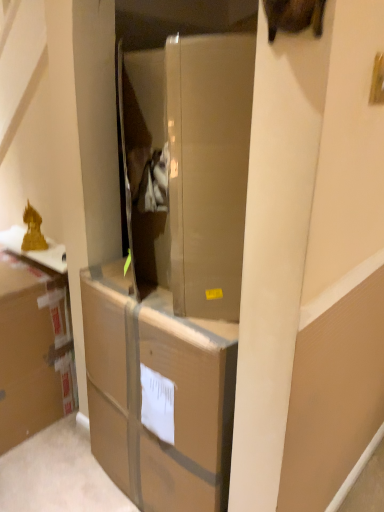
Question: Does brown cardboard box at center have a lesser width compared to brown cardboard box at left?

Choices:
 (A) no
 (B) yes

Answer: (A)

Question: Is brown cardboard box at center bigger than brown cardboard box at left?

Choices:
 (A) no
 (B) yes

Answer: (B)

Question: Is brown cardboard box at center positioned with its back to brown cardboard box at left?

Choices:
 (A) no
 (B) yes

Answer: (A)

Question: Is there a large distance between brown cardboard box at center and brown cardboard box at left?

Choices:
 (A) no
 (B) yes

Answer: (A)

Question: Is brown cardboard box at center taller than brown cardboard box at left?

Choices:
 (A) no
 (B) yes

Answer: (B)

Question: Does brown cardboard box at center have a lesser height compared to brown cardboard box at left?

Choices:
 (A) no
 (B) yes

Answer: (A)

Question: Is brown cardboard box at left to the left of brown cardboard box at center from the viewer's perspective?

Choices:
 (A) no
 (B) yes

Answer: (B)

Question: From the image's perspective, does brown cardboard box at left appear higher than brown cardboard box at center?

Choices:
 (A) no
 (B) yes

Answer: (B)

Question: Is brown cardboard box at center surrounded by brown cardboard box at left?

Choices:
 (A) no
 (B) yes

Answer: (A)

Question: Considering the relative sizes of brown cardboard box at left and brown cardboard box at center in the image provided, is brown cardboard box at left wider than brown cardboard box at center?

Choices:
 (A) yes
 (B) no

Answer: (B)

Question: From the image's perspective, is brown cardboard box at left below brown cardboard box at center?

Choices:
 (A) yes
 (B) no

Answer: (B)

Question: Can you confirm if brown cardboard box at left is taller than brown cardboard box at center?

Choices:
 (A) no
 (B) yes

Answer: (A)

Question: Do you think brown cardboard box at left is within brown cardboard box at center, or outside of it?

Choices:
 (A) inside
 (B) outside

Answer: (B)